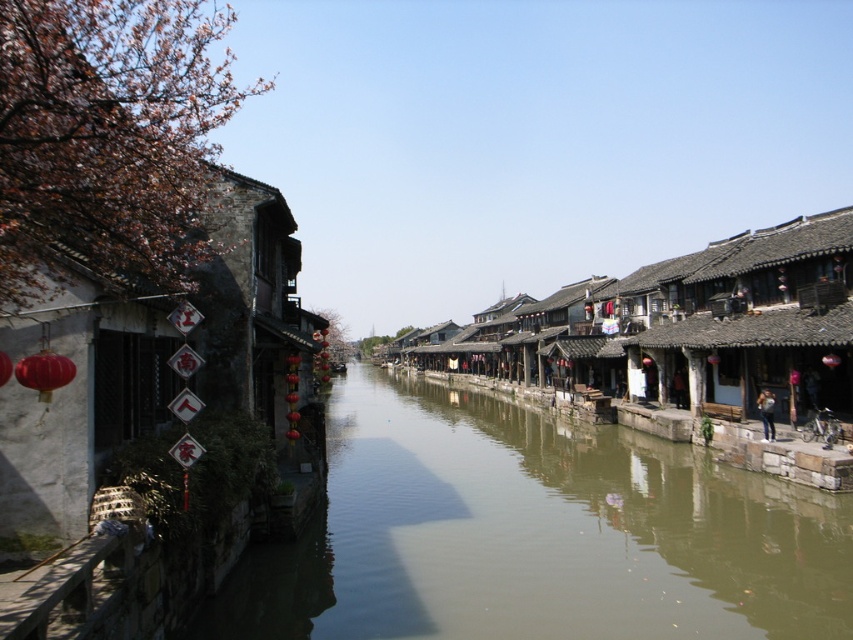
Based on the photo, you are standing at a point in the canal scene and want to determine the relative positions of two points marked in the image. Which of the two points, point 1 at coordinates point 1 at coordinates point (440, 493) or point 2 at coordinates point (508, 378), is closer to you?

Point 1 at coordinates point (440, 493) is closer to you because it is in front of point 2 at coordinates point (508, 378).